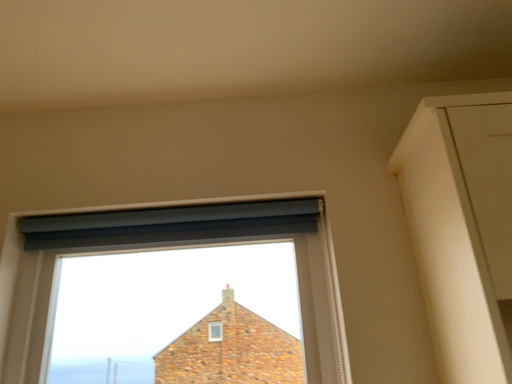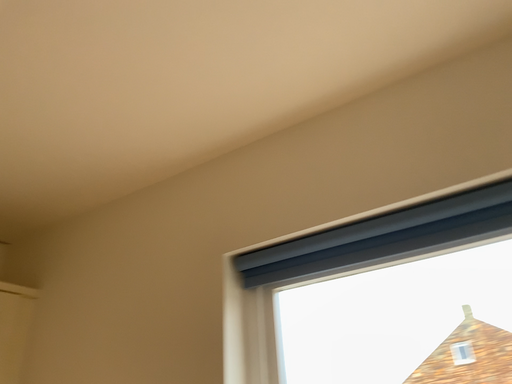
Question: How did the camera likely rotate when shooting the video?

Choices:
 (A) rotated right
 (B) rotated left

Answer: (B)